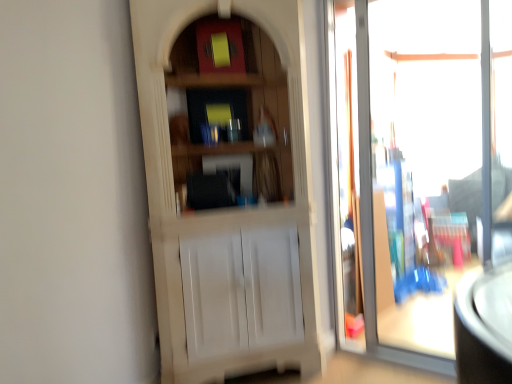
The height and width of the screenshot is (384, 512). Describe the element at coordinates (419, 168) in the screenshot. I see `transparent glass door at right` at that location.

Locate an element on the screen. The width and height of the screenshot is (512, 384). transparent glass door at right is located at coordinates (419, 168).

Measure the distance between point (x=449, y=114) and camera.

Point (x=449, y=114) is 4.44 meters from camera.

Measure the distance between transparent glass door at right and camera.

transparent glass door at right and camera are 2.29 meters apart from each other.

Image resolution: width=512 pixels, height=384 pixels. Identify the location of transparent glass door at right. (419, 168).